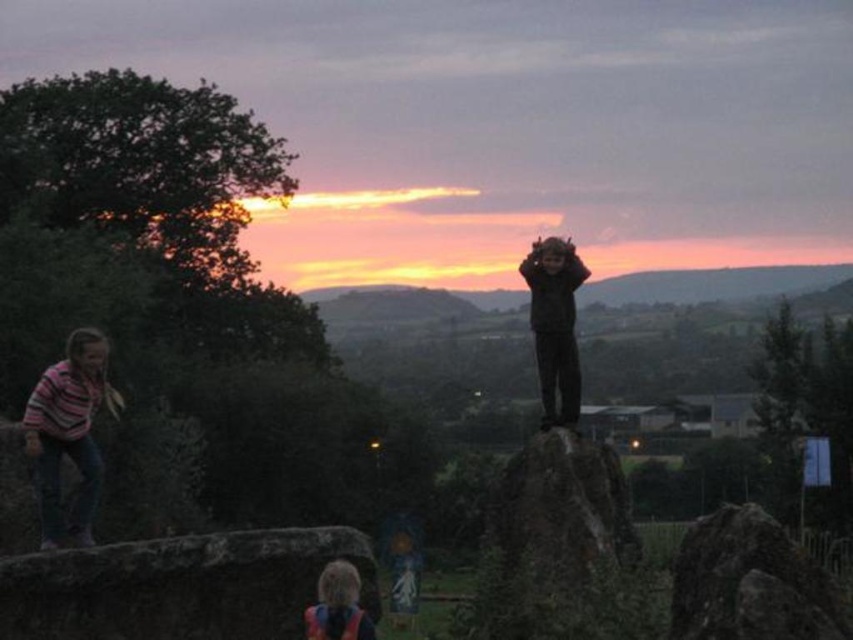
You are standing at the point with coordinates point (775, 637) and want to walk to the point with coordinates point (94, 372). Which direction should you move in?

You should move away from the camera because point (94, 372) is further away from the camera than point (775, 637).

You are standing at the point labeled as point (178,586) in the image. Looking towards the rough stone boulder at lower left, which direction should you move to reach the person climbing the rocky structure on the left side?

The rough stone boulder at lower left is located at point (178,586). Since the person climbing the rocky structure is on the left side of the image, you should move towards the left from the boulder to reach them.

You are standing at the rough stone boulder at lower left and want to throw a small pebble to a friend who is standing 12 meters away. Can you reach your friend with one throw?

The distance between you and your friend is 12 meters, and the rough stone boulder at lower left and viewer are 11.95 meters apart from each other. Since 11.95 meters is slightly less than 12 meters, you might barely reach your friend with a strong throw, but it could be challenging.